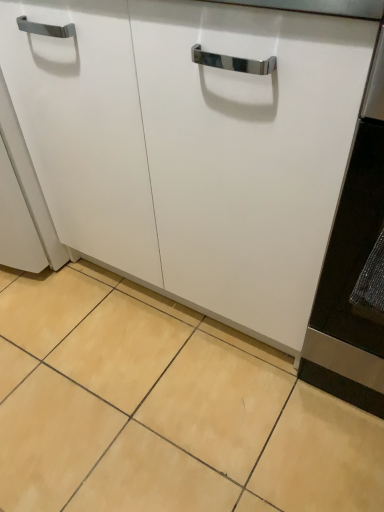
Question: From a real-world perspective, is white matte cabinet at center above or below beige ceramic tile at lower center?

Choices:
 (A) below
 (B) above

Answer: (B)

Question: Considering the positions of white matte cabinet at center and beige ceramic tile at lower center in the image, is white matte cabinet at center bigger or smaller than beige ceramic tile at lower center?

Choices:
 (A) small
 (B) big

Answer: (B)

Question: In the image, is white matte cabinet at center positioned in front of or behind beige ceramic tile at lower center?

Choices:
 (A) behind
 (B) front

Answer: (B)

Question: Does point (304, 438) appear closer or farther from the camera than point (183, 249)?

Choices:
 (A) farther
 (B) closer

Answer: (B)

Question: Considering the relative positions of beige ceramic tile at lower center and white matte cabinet at center in the image provided, is beige ceramic tile at lower center to the left or to the right of white matte cabinet at center?

Choices:
 (A) right
 (B) left

Answer: (B)

Question: From the image's perspective, is beige ceramic tile at lower center above or below white matte cabinet at center?

Choices:
 (A) above
 (B) below

Answer: (B)

Question: In terms of size, does beige ceramic tile at lower center appear bigger or smaller than white matte cabinet at center?

Choices:
 (A) big
 (B) small

Answer: (B)